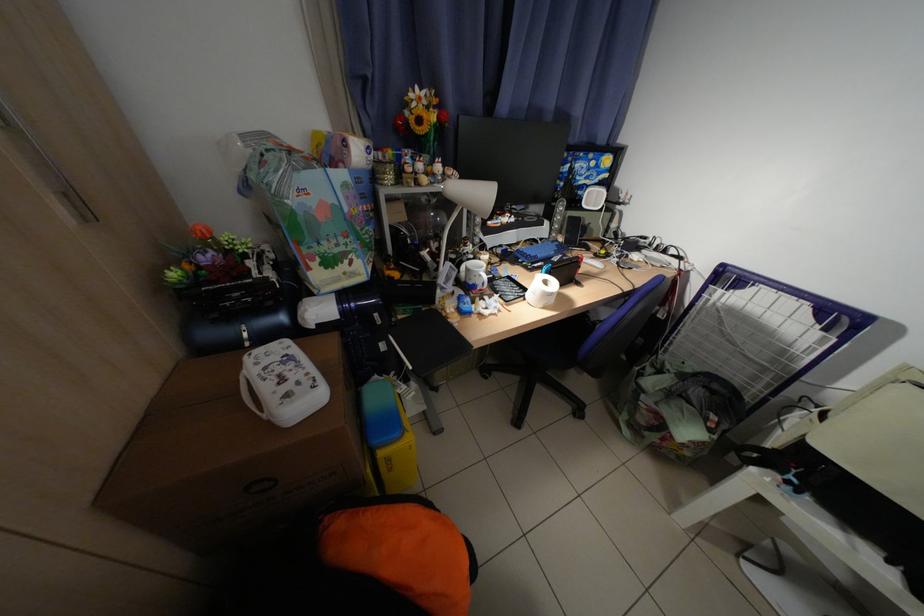
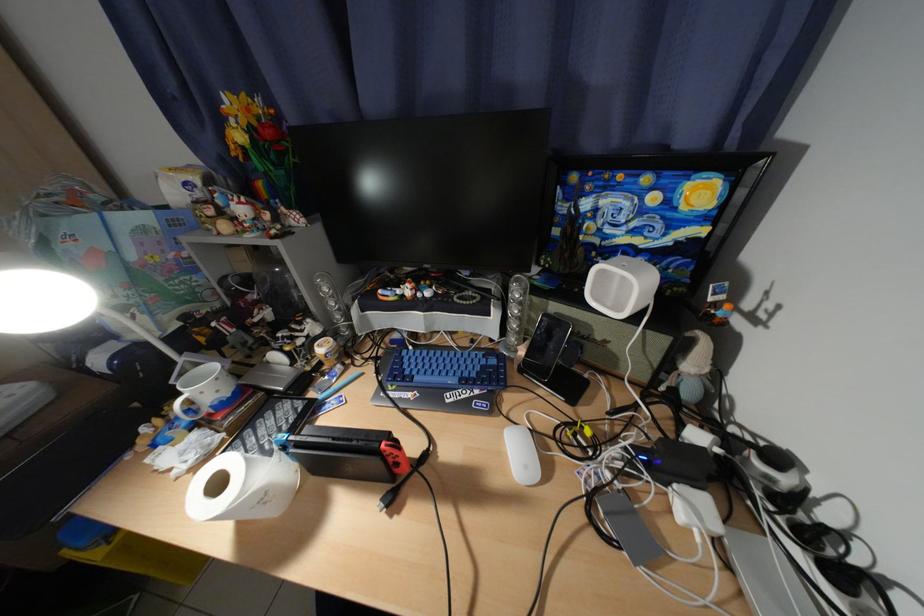
Find the pixel in the second image that matches point (572, 241) in the first image.

(533, 354)